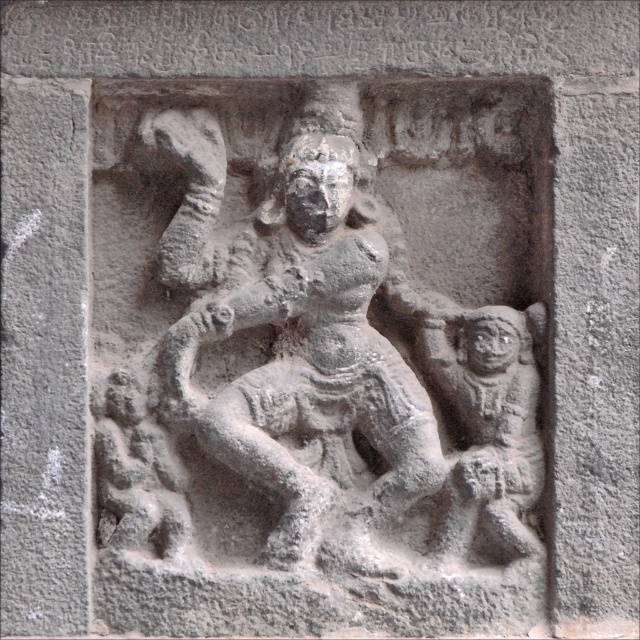
You are an art conservator examining the ancient stone relief sculpture. You need to clean both the gray stone sculpture at center and the gray stone monkey at right. Which object should you clean first if you want to start with the one that is closer to you?

The gray stone sculpture at center is closer to the viewer than the gray stone monkey at right, so you should clean the gray stone sculpture at center first.